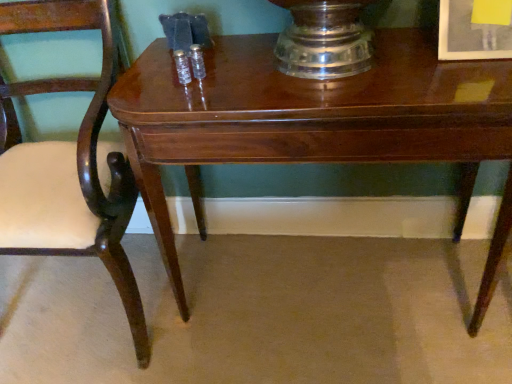
Where is `matte white picture frame at upper right`? The height and width of the screenshot is (384, 512). matte white picture frame at upper right is located at coordinates (475, 29).

This screenshot has height=384, width=512. Identify the location of mahogany wood chair at left. (71, 164).

Consider the image. Is glossy wood table at center positioned with its back to mahogany wood chair at left?

No, glossy wood table at center's orientation is not away from mahogany wood chair at left.

From their relative heights in the image, would you say glossy wood table at center is taller or shorter than mahogany wood chair at left?

Answer: In the image, glossy wood table at center appears to be shorter than mahogany wood chair at left.

Which object is further away from the camera taking this photo, glossy wood table at center or mahogany wood chair at left?

glossy wood table at center is more distant.

Where is `chair above the glossy wood table at center (from the image's perspective)`? The height and width of the screenshot is (384, 512). chair above the glossy wood table at center (from the image's perspective) is located at coordinates (71, 164).

The height and width of the screenshot is (384, 512). Find the location of `picture frame that appears behind the mahogany wood chair at left`. picture frame that appears behind the mahogany wood chair at left is located at coordinates pyautogui.click(x=475, y=29).

Based on the photo, is matte white picture frame at upper right inside mahogany wood chair at left?

No.

From a real-world perspective, which object rests below the other?

mahogany wood chair at left is physically lower.

From the picture: Could you tell me if mahogany wood chair at left is turned towards matte white picture frame at upper right?

No, mahogany wood chair at left is not facing towards matte white picture frame at upper right.

Is matte white picture frame at upper right not near glossy wood table at center?

A: matte white picture frame at upper right is actually quite close to glossy wood table at center.

The image size is (512, 384). What are the coordinates of `picture frame behind the glossy wood table at center` in the screenshot? It's located at (475, 29).

Looking at the image, does matte white picture frame at upper right seem bigger or smaller compared to glossy wood table at center?

In the image, matte white picture frame at upper right appears to be smaller than glossy wood table at center.

Does point (480, 48) lie behind point (380, 106)?

Yes.

Is glossy wood table at center bigger than matte white picture frame at upper right?

Yes.

Looking at this image, which object is positioned more to the right, glossy wood table at center or matte white picture frame at upper right?

matte white picture frame at upper right.

Which of these two, glossy wood table at center or matte white picture frame at upper right, is thinner?

Thinner between the two is matte white picture frame at upper right.

Between glossy wood table at center and matte white picture frame at upper right, which one is positioned in front?

glossy wood table at center.

Which is closer to the camera, (455, 4) or (86, 155)?

Positioned in front is point (455, 4).

Measure the distance between matte white picture frame at upper right and mahogany wood chair at left.

35.20 inches.

From the image's perspective, is matte white picture frame at upper right located beneath mahogany wood chair at left?

No, from the image's perspective, matte white picture frame at upper right is not below mahogany wood chair at left.

Which object is further away from the camera, matte white picture frame at upper right or mahogany wood chair at left?

matte white picture frame at upper right is further away from the camera.

Considering the positions of objects mahogany wood chair at left and glossy wood table at center in the image provided, who is more to the right, mahogany wood chair at left or glossy wood table at center?

Positioned to the right is glossy wood table at center.

Is mahogany wood chair at left not inside glossy wood table at center?

Absolutely, mahogany wood chair at left is external to glossy wood table at center.

Is mahogany wood chair at left next to glossy wood table at center and touching it?

mahogany wood chair at left and glossy wood table at center are not in contact.

Which object is thinner, mahogany wood chair at left or glossy wood table at center?

With smaller width is glossy wood table at center.

Locate an element on the screen. Image resolution: width=512 pixels, height=384 pixels. table on the right side of mahogany wood chair at left is located at coordinates (312, 122).

The height and width of the screenshot is (384, 512). I want to click on picture frame lying above the mahogany wood chair at left (from the image's perspective), so click(x=475, y=29).

Estimate the real-world distances between objects in this image. Which object is further from glossy wood table at center, matte white picture frame at upper right or mahogany wood chair at left?

matte white picture frame at upper right.

When comparing their distances from mahogany wood chair at left, does matte white picture frame at upper right or glossy wood table at center seem further?

The object further to mahogany wood chair at left is matte white picture frame at upper right.

Looking at the image, which one is located further to mahogany wood chair at left, glossy wood table at center or matte white picture frame at upper right?

Based on the image, matte white picture frame at upper right appears to be further to mahogany wood chair at left.

Estimate the real-world distances between objects in this image. Which object is further from matte white picture frame at upper right, mahogany wood chair at left or glossy wood table at center?

mahogany wood chair at left is positioned further to the anchor matte white picture frame at upper right.

From the image, which object appears to be farther from glossy wood table at center, mahogany wood chair at left or matte white picture frame at upper right?

Based on the image, matte white picture frame at upper right appears to be further to glossy wood table at center.

From the image, which object appears to be farther from matte white picture frame at upper right, glossy wood table at center or mahogany wood chair at left?

mahogany wood chair at left is further to matte white picture frame at upper right.

I want to click on table between mahogany wood chair at left and matte white picture frame at upper right from left to right, so click(x=312, y=122).